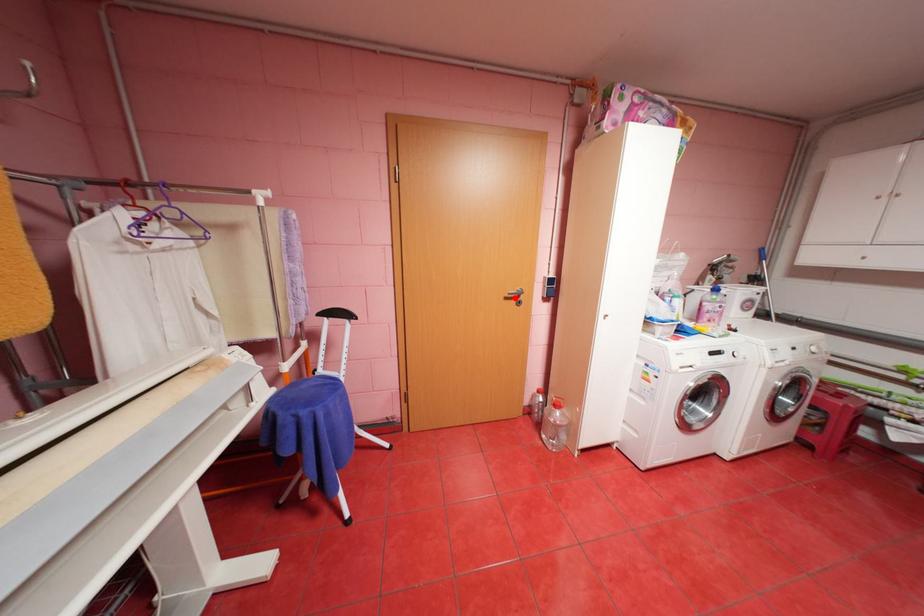
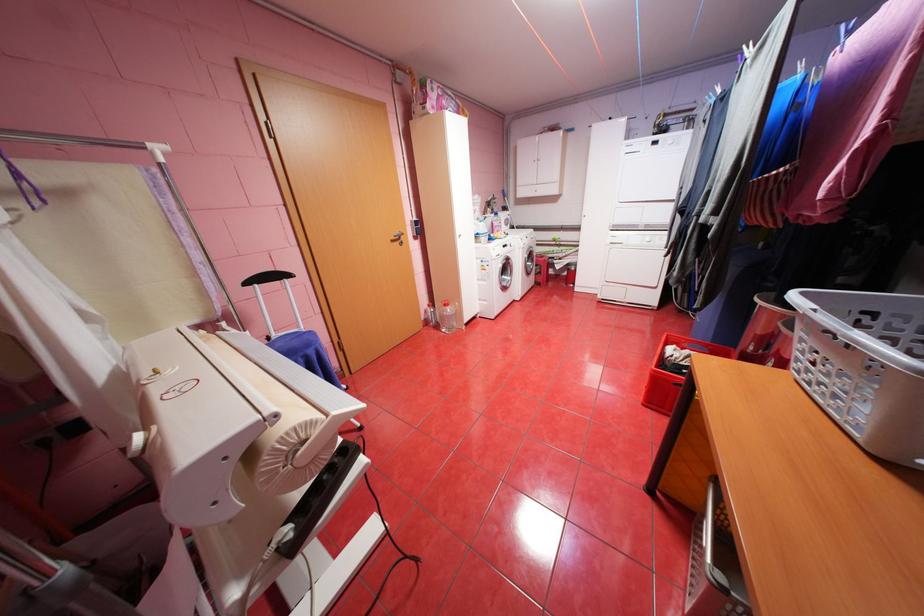
Question: I am providing you with two images of the same scene from different viewpoints. In image1, a red point is highlighted. Considering the same 3D point in image2, which of the following is correct?

Choices:
 (A) It is closer
 (B) It is farther

Answer: (A)